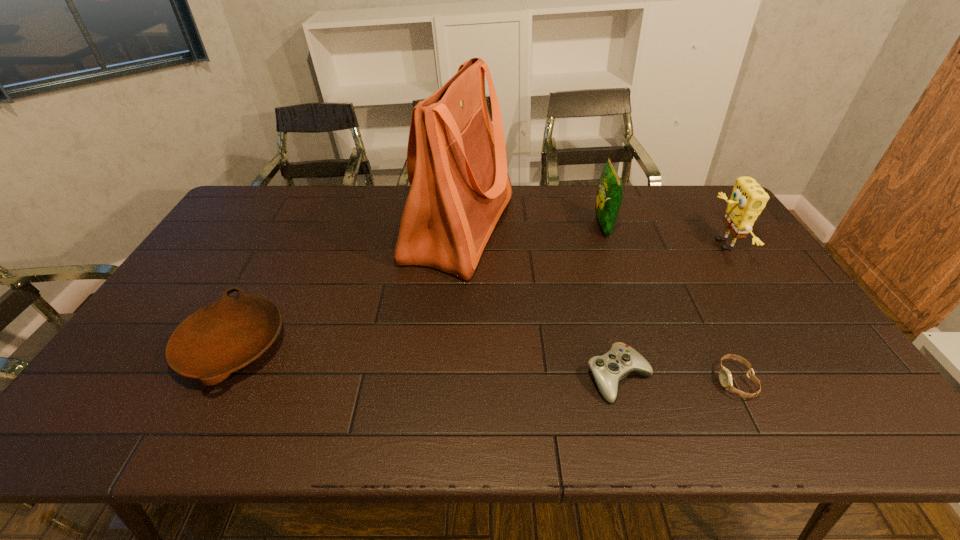
In the image, there is a desktop. Where is `free region at the left edge`? free region at the left edge is located at coordinates (226, 238).

What are the coordinates of `vacant area at the right edge` in the screenshot? It's located at (725, 255).

The width and height of the screenshot is (960, 540). Identify the location of vacant space at the far left corner of the desktop. (281, 188).

This screenshot has height=540, width=960. In order to click on free point at the near right corner in this screenshot , I will do `click(866, 416)`.

Locate an element on the screen. This screenshot has height=540, width=960. vacant point located between the crisp (potato chip) and the shortest object is located at coordinates (669, 303).

At what (x,y) coordinates should I click in order to perform the action: click on free space between the crisp (potato chip) and the plate. Please return your answer as a coordinate pair (x, y). Looking at the image, I should click on (418, 286).

At what (x,y) coordinates should I click in order to perform the action: click on free spot between the leftmost object and the second object from right to left. Please return your answer as a coordinate pair (x, y). This screenshot has width=960, height=540. Looking at the image, I should click on (484, 364).

Where is `free space between the shortest object and the control`? The image size is (960, 540). free space between the shortest object and the control is located at coordinates (677, 380).

Locate an element on the screen. The width and height of the screenshot is (960, 540). free point between the control and the fifth object from left to right is located at coordinates (677, 380).

This screenshot has height=540, width=960. What are the coordinates of `blank region between the fifth object from right to left and the leftmost object` in the screenshot? It's located at (347, 287).